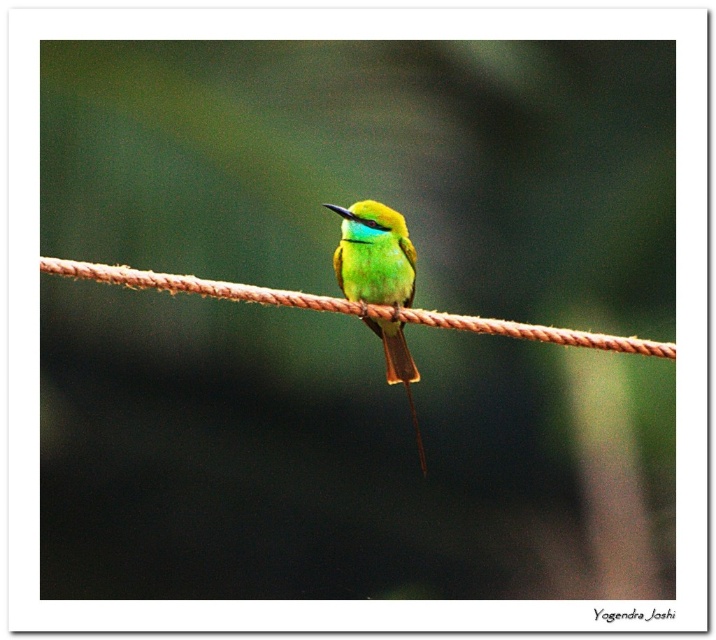
You are a photographer trying to capture the vibrant green bird perched on the taut brown rope. You notice two points marked in the image at coordinates point (644,340) and point (374,332). Which point is closer to the camera lens?

Point (644,340) is in front of point (374,332), so it is closer to the camera lens.

You are a photographer aiming to capture a closeup of the green glossy bird at center. The brown rope at center is blocking part of the bird. Can you adjust your camera angle to focus on the bird without the rope obscuring it?

The brown rope at center is bigger than the green glossy bird at center, so adjusting the camera angle might not be possible since the rope is larger and likely covers more of the bird. Consider moving closer or using a different lens to isolate the bird from the rope.

In the scene shown: You are a photographer aiming to capture a closeup of the green glossy bird at center and the brown rope at center in the image. The camera lens has a maximum focus range of 10 inches. Can you focus on both subjects simultaneously without refocusing?

The brown rope at center and green glossy bird at center are 11.71 inches apart from each other. Since the distance between them exceeds the camera lens maximum focus range of 10 inches, you cannot focus on both subjects simultaneously without refocusing.